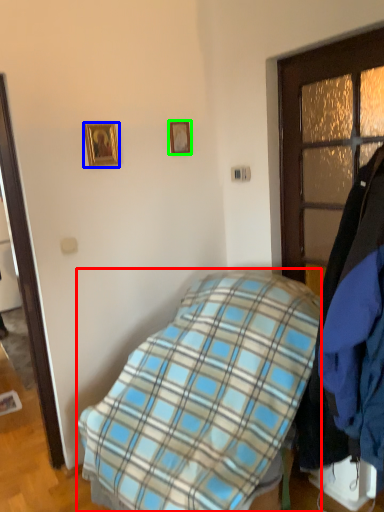
Question: Estimate the real-world distances between objects in this image. Which object is closer to bed (highlighted by a red box), picture frame (highlighted by a blue box) or picture frame (highlighted by a green box)?

Choices:
 (A) picture frame
 (B) picture frame

Answer: (A)